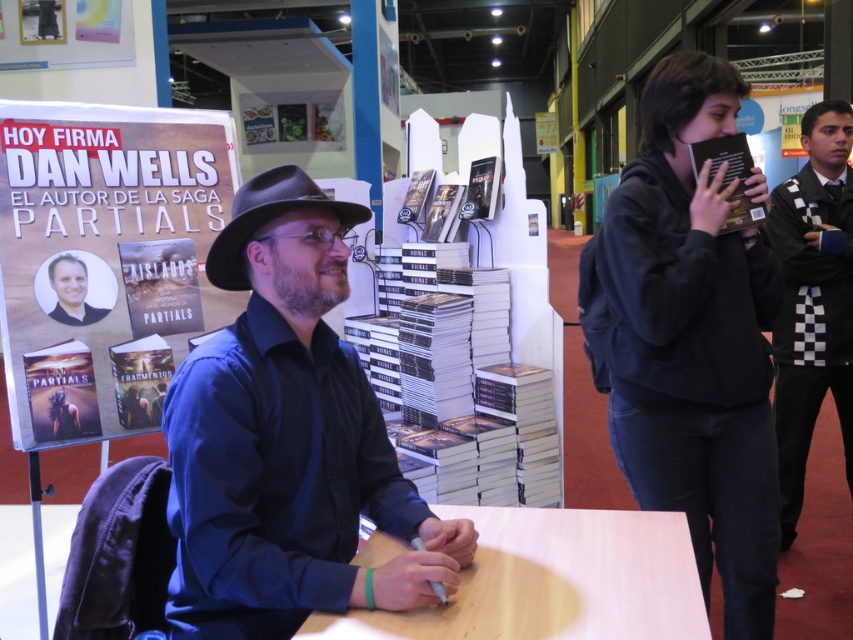
Question: Among these points, which one is farthest from the camera?

Choices:
 (A) (85, 188)
 (B) (216, 262)

Answer: (A)

Question: Which object appears farthest from the camera in this image?

Choices:
 (A) white paper poster at upper left
 (B) light brown wood table at center

Answer: (A)

Question: Which point appears closest to the camera in this image?

Choices:
 (A) (279, 637)
 (B) (286, 192)
 (C) (590, 349)
 (D) (94, 29)

Answer: (A)

Question: Can you confirm if matte black shirt at center is positioned to the left of black hoodie at upper right?

Choices:
 (A) no
 (B) yes

Answer: (B)

Question: Does checkered fabric scarf at right come in front of hardcover book at left?

Choices:
 (A) no
 (B) yes

Answer: (A)

Question: Is matte black shirt at center smaller than light brown wood table at center?

Choices:
 (A) yes
 (B) no

Answer: (B)